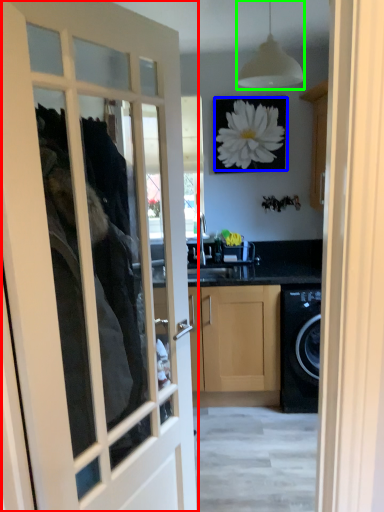
Question: Which object is the closest to the door (highlighted by a red box)? Choose among these: flower (highlighted by a blue box) or light fixture (highlighted by a green box).

Choices:
 (A) flower
 (B) light fixture

Answer: (A)